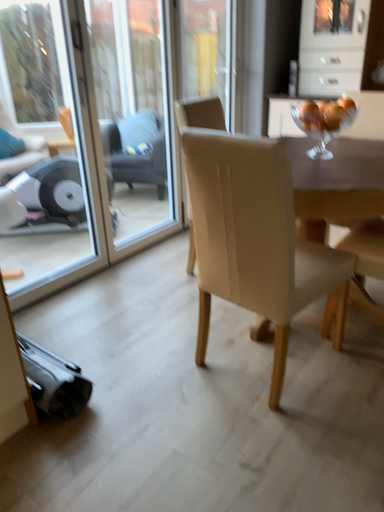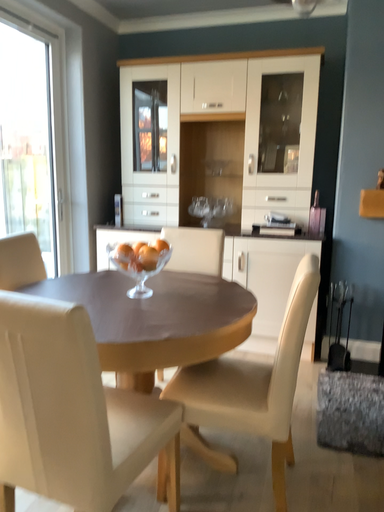
Question: Which way did the camera rotate in the video?

Choices:
 (A) rotated left
 (B) rotated right

Answer: (B)